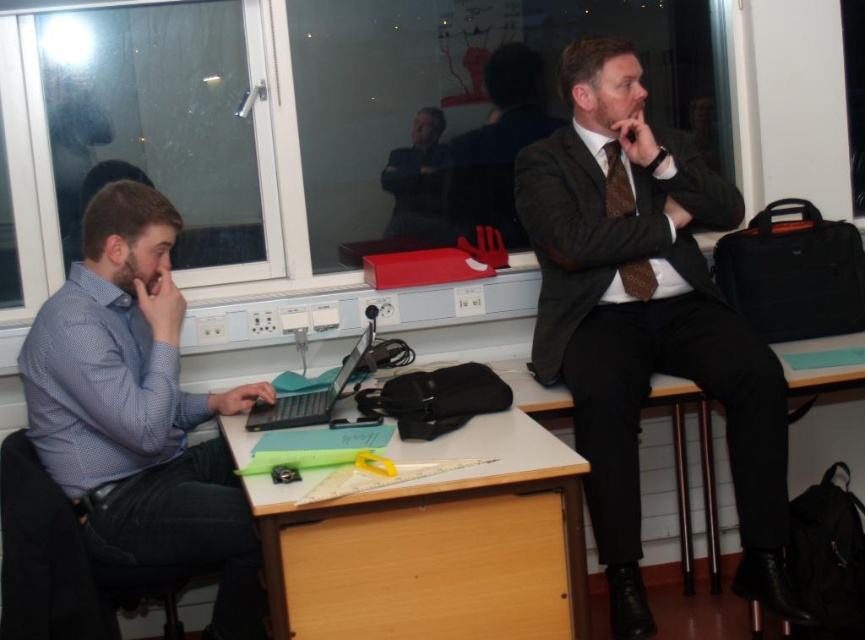
From the picture: Is blue dotted shirt at left above wooden at center?

Indeed, blue dotted shirt at left is positioned over wooden at center.

Which is more to the left, blue dotted shirt at left or wooden at center?

Positioned to the left is blue dotted shirt at left.

Locate an element on the screen. This screenshot has width=865, height=640. blue dotted shirt at left is located at coordinates (139, 412).

Does blue dotted shirt at left have a smaller size compared to teal plastic laptop at center?

No, blue dotted shirt at left is not smaller than teal plastic laptop at center.

Between blue dotted shirt at left and teal plastic laptop at center, which one appears on the left side from the viewer's perspective?

From the viewer's perspective, blue dotted shirt at left appears more on the left side.

Between point (125, 372) and point (370, 337), which one is positioned behind?

Positioned behind is point (370, 337).

The height and width of the screenshot is (640, 865). I want to click on blue dotted shirt at left, so click(139, 412).

Between point (424, 536) and point (425, 115), which one is positioned in front?

Point (424, 536) is more forward.

Between point (441, 612) and point (421, 214), which one is positioned in front?

Point (441, 612)

Where is `wooden at center`? The width and height of the screenshot is (865, 640). wooden at center is located at coordinates (436, 545).